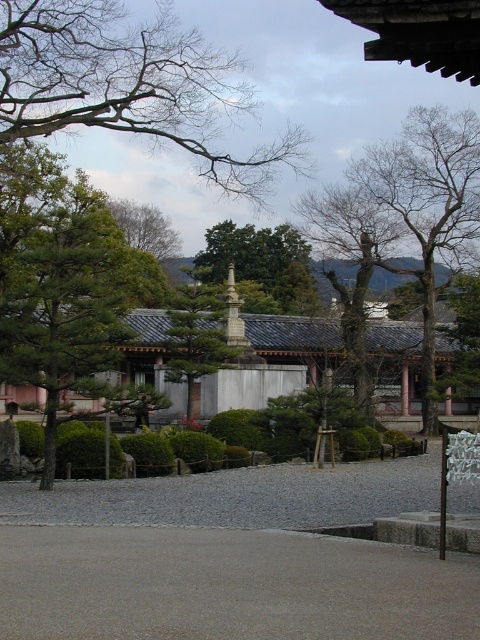
You are a visitor walking along the gravel pathway in the Japanese garden. You notice a bare wood tree at upper right and a green leafy tree at center. Which tree is positioned lower in the garden layout?

The bare wood tree at upper right is located below the green leafy tree at center, meaning it is positioned lower in the garden layout.

In the scene shown: You are a visitor in the Japanese garden and want to take a photo of both the bare wood tree at upper right and the green leafy tree at center. The camera you have can capture objects within a 12 meter range. Will you be able to fit both trees in the same frame without moving closer?

The distance between the bare wood tree at upper right and the green leafy tree at center is 10.56 meters, which is within the 12 meter range of the camera. Therefore, both trees can be captured in the same frame without moving closer.

You are a visitor standing at the entrance of the garden. You see the gray gravel at center and the green stone statue at center. Which object is closer to you?

The gray gravel at center is closer to the viewer than the green stone statue at center.